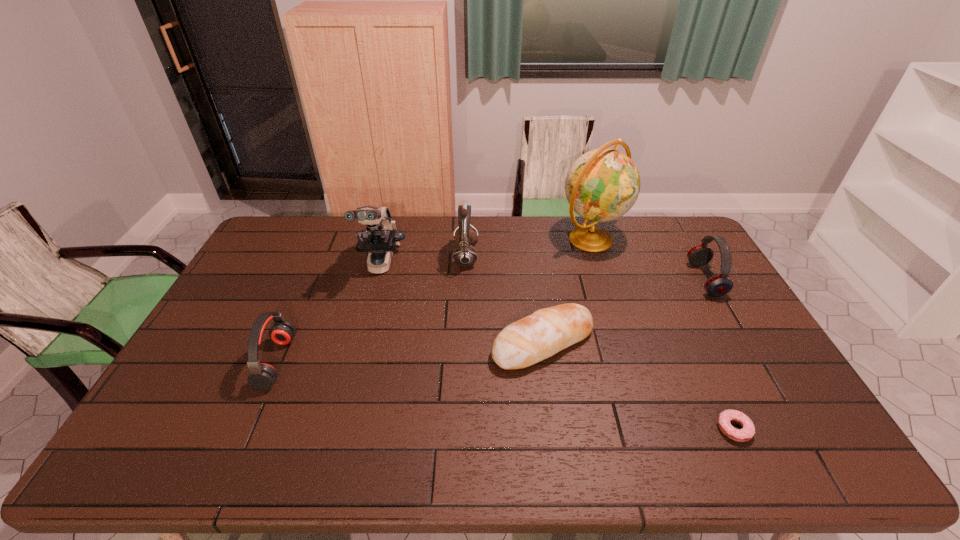
In order to click on globe that is at the far edge in this screenshot , I will do `click(603, 184)`.

At what (x,y) coordinates should I click in order to perform the action: click on microscope that is positioned at the far edge. Please return your answer as a coordinate pair (x, y). Image resolution: width=960 pixels, height=540 pixels. Looking at the image, I should click on (379, 240).

This screenshot has width=960, height=540. What are the coordinates of `earphone located in the far edge section of the desktop` in the screenshot? It's located at (465, 255).

Where is `object present at the near edge`? The width and height of the screenshot is (960, 540). object present at the near edge is located at coordinates (745, 434).

In order to click on object that is at the right edge in this screenshot , I will do `click(718, 285)`.

Image resolution: width=960 pixels, height=540 pixels. What are the coordinates of `free space at the far edge of the desktop` in the screenshot? It's located at (640, 226).

This screenshot has height=540, width=960. Find the location of `vacant region at the near edge`. vacant region at the near edge is located at coordinates (205, 461).

Image resolution: width=960 pixels, height=540 pixels. Find the location of `free space at the left edge`. free space at the left edge is located at coordinates (234, 314).

You are a GUI agent. You are given a task and a screenshot of the screen. Output one action in this format:
    pyautogui.click(x=<x>, y=<y>)
    Task: Click on the vacant space at the right edge of the desktop
    The height and width of the screenshot is (540, 960).
    Given the screenshot: What is the action you would take?
    pyautogui.click(x=788, y=397)

You are a GUI agent. You are given a task and a screenshot of the screen. Output one action in this format:
    pyautogui.click(x=<x>, y=<y>)
    Task: Click on the free space at the near left corner
    
    Given the screenshot: What is the action you would take?
    pyautogui.click(x=148, y=437)